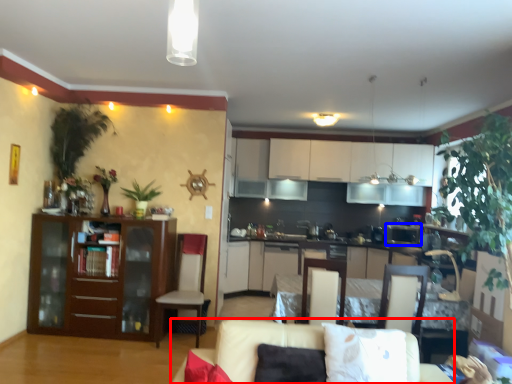
Question: Which of the following is the closest to the observer, couch (highlighted by a red box) or appliance (highlighted by a blue box)?

Choices:
 (A) couch
 (B) appliance

Answer: (A)